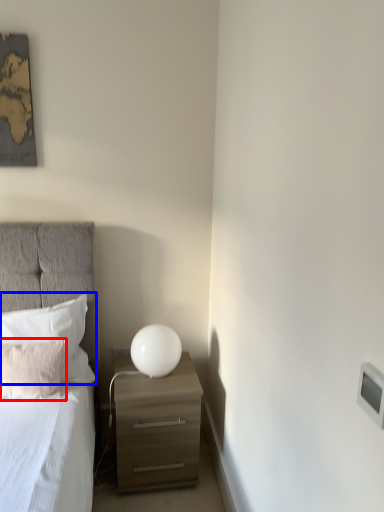
Question: Which point is closer to the camera, pillow (highlighted by a red box) or pillow (highlighted by a blue box)?

Choices:
 (A) pillow
 (B) pillow

Answer: (A)